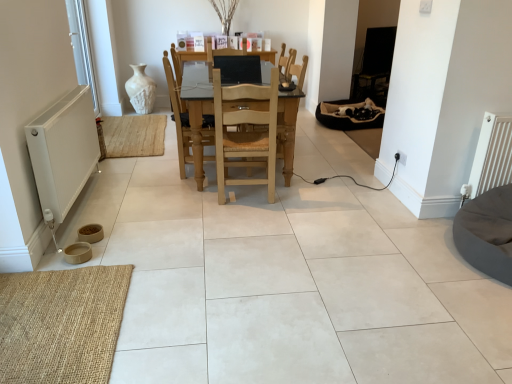
The image size is (512, 384). I want to click on white plastic window screen at left, so click(82, 48).

The width and height of the screenshot is (512, 384). What do you see at coordinates (82, 48) in the screenshot?
I see `white plastic window screen at left` at bounding box center [82, 48].

What do you see at coordinates (199, 130) in the screenshot? I see `light wood table at center` at bounding box center [199, 130].

Where is `light wood table at center`? Image resolution: width=512 pixels, height=384 pixels. light wood table at center is located at coordinates (199, 130).

What do you see at coordinates (63, 153) in the screenshot? This screenshot has width=512, height=384. I see `white matte radiator at lower left` at bounding box center [63, 153].

Describe the element at coordinates (178, 118) in the screenshot. I see `light wood chair at center, the first chair when ordered from left to right` at that location.

At what (x,y) coordinates should I click in order to perform the action: click on soft black fabric bean bag at center right, the 1th bean bag chair from the back. Please return your answer as a coordinate pair (x, y). This screenshot has height=384, width=512. Looking at the image, I should click on (347, 116).

Could you measure the distance between soft black fabric bean bag at center right, which appears as the 2th bean bag chair when ordered from the bottom, and white plastic window screen at left?

They are 2.73 meters apart.

From the picture: Considering the relative sizes of soft black fabric bean bag at center right, the 2th bean bag chair in the front-to-back sequence, and white plastic window screen at left in the image provided, is soft black fabric bean bag at center right, the 2th bean bag chair in the front-to-back sequence, taller than white plastic window screen at left?

No.

Consider the image. From a real-world perspective, between soft black fabric bean bag at center right, which appears as the 2th bean bag chair when ordered from the bottom, and white plastic window screen at left, who is vertically lower?

soft black fabric bean bag at center right, which appears as the 2th bean bag chair when ordered from the bottom.

From the image's perspective, who appears lower, soft black fabric bean bag at center right, the first bean bag chair viewed from the top, or white plastic window screen at left?

soft black fabric bean bag at center right, the first bean bag chair viewed from the top, appears lower in the image.

Is light wood table at center facing away from white plastic window screen at left?

No, light wood table at center is not facing away from white plastic window screen at left.

Considering the sizes of light wood table at center and white plastic window screen at left in the image, is light wood table at center taller or shorter than white plastic window screen at left?

light wood table at center is shorter than white plastic window screen at left.

Which is behind, light wood table at center or white plastic window screen at left?

white plastic window screen at left is further away from the camera.

From the image's perspective, would you say light wood table at center is positioned over white plastic window screen at left?

Incorrect, from the image's perspective, light wood table at center is lower than white plastic window screen at left.

How much distance is there between matte black monitor at center and light wood table at center?

A distance of 17.16 inches exists between matte black monitor at center and light wood table at center.

From the picture: Would you consider matte black monitor at center to be distant from light wood table at center?

They are positioned close to each other.

Does matte black monitor at center have a lesser width compared to light wood table at center?

Yes, matte black monitor at center is thinner than light wood table at center.

Identify the location of computer located behind the light wood table at center. The height and width of the screenshot is (384, 512). (239, 69).

Who is bigger, white matte radiator at lower left or dark gray fabric bean bag at lower right, arranged as the second bean bag chair when viewed from the back?

With larger size is dark gray fabric bean bag at lower right, arranged as the second bean bag chair when viewed from the back.

From a real-world perspective, is white matte radiator at lower left beneath dark gray fabric bean bag at lower right, which is the first bean bag chair from front to back?

No.

Does white matte radiator at lower left turn towards dark gray fabric bean bag at lower right, which is the first bean bag chair from front to back?

Yes.

Is white matte radiator at lower left positioned behind dark gray fabric bean bag at lower right, the 1th bean bag chair in the bottom-to-top sequence?

That is True.

Is white plastic window screen at left looking in the opposite direction of light wood table at center?

No.

Who is bigger, white plastic window screen at left or light wood table at center?

Bigger between the two is light wood table at center.

Based on the photo, is white plastic window screen at left located outside light wood table at center?

Yes, white plastic window screen at left is located beyond the bounds of light wood table at center.

Is white plastic window screen at left to the left of light wood table at center from the viewer's perspective?

Yes.

Which object is positioned more to the right, soft black fabric bean bag at center right, which appears as the 2th bean bag chair when ordered from the bottom, or matte black monitor at center?

From the viewer's perspective, soft black fabric bean bag at center right, which appears as the 2th bean bag chair when ordered from the bottom, appears more on the right side.

From the picture: Relative to matte black monitor at center, is soft black fabric bean bag at center right, which appears as the 2th bean bag chair when ordered from the bottom, in front or behind?

soft black fabric bean bag at center right, which appears as the 2th bean bag chair when ordered from the bottom, is positioned farther from the viewer than matte black monitor at center.

Would you say soft black fabric bean bag at center right, the 2th bean bag chair in the front-to-back sequence, is inside or outside matte black monitor at center?

soft black fabric bean bag at center right, the 2th bean bag chair in the front-to-back sequence, is outside matte black monitor at center.

Which object is wider, soft black fabric bean bag at center right, the 2th bean bag chair in the front-to-back sequence, or matte black monitor at center?

soft black fabric bean bag at center right, the 2th bean bag chair in the front-to-back sequence.

Which is correct: soft black fabric bean bag at center right, the 2th bean bag chair in the front-to-back sequence, is inside white matte radiator at lower left, or outside of it?

soft black fabric bean bag at center right, the 2th bean bag chair in the front-to-back sequence, is outside white matte radiator at lower left.

From the picture: From a real-world perspective, is soft black fabric bean bag at center right, which appears as the 2th bean bag chair when ordered from the bottom, on white matte radiator at lower left?

No, from a real-world perspective, soft black fabric bean bag at center right, which appears as the 2th bean bag chair when ordered from the bottom, is not on top of white matte radiator at lower left.

In the image, is soft black fabric bean bag at center right, the 1th bean bag chair from the back, positioned in front of or behind white matte radiator at lower left?

soft black fabric bean bag at center right, the 1th bean bag chair from the back, is behind white matte radiator at lower left.

Which point is more distant from viewer, (325,124) or (49,168)?

The point (325,124) is farther.

Where is `bean bag chair behind the white plastic window screen at left`? This screenshot has height=384, width=512. bean bag chair behind the white plastic window screen at left is located at coordinates (347, 116).

I want to click on table located below the white plastic window screen at left (from the image's perspective), so click(199, 130).

Looking at the image, which one is located closer to burlap mat at lower left, white matte radiator at lower left or natural wood/rattan chair at center, the 2th chair when ordered from left to right?

Based on the image, white matte radiator at lower left appears to be nearer to burlap mat at lower left.

Looking at the image, which one is located closer to light wood table at center, burlap mat at lower left or dark gray fabric bean bag at lower right, the 1th bean bag chair in the bottom-to-top sequence?

Based on the image, burlap mat at lower left appears to be nearer to light wood table at center.

Looking at the image, which one is located further to matte black monitor at center, soft black fabric bean bag at center right, the 2th bean bag chair in the front-to-back sequence, or burlap mat at lower left?

Among the two, soft black fabric bean bag at center right, the 2th bean bag chair in the front-to-back sequence, is located further to matte black monitor at center.

From the picture: Which object lies nearer to the anchor point light wood table at center, light wood chair at center, the second chair viewed from the right, or soft black fabric bean bag at center right, the 1th bean bag chair from the back?

The object closer to light wood table at center is light wood chair at center, the second chair viewed from the right.

Looking at the image, which one is located further to natural wood/rattan chair at center, the 2th chair when ordered from left to right, burlap mat at lower left or dark gray fabric bean bag at lower right, arranged as the second bean bag chair when viewed from the back?

Among the two, dark gray fabric bean bag at lower right, arranged as the second bean bag chair when viewed from the back, is located further to natural wood/rattan chair at center, the 2th chair when ordered from left to right.

Based on their spatial positions, is light wood chair at center, the second chair viewed from the right, or light wood table at center closer to matte black monitor at center?

light wood table at center is closer to matte black monitor at center.

Looking at the image, which one is located closer to white matte radiator at lower left, light wood chair at center, the second chair viewed from the right, or white plastic window screen at left?

light wood chair at center, the second chair viewed from the right, is positioned closer to the anchor white matte radiator at lower left.

Based on their spatial positions, is light wood table at center or dark gray fabric bean bag at lower right, which is the first bean bag chair from front to back, further from light wood chair at center, the first chair when ordered from left to right?

Among the two, dark gray fabric bean bag at lower right, which is the first bean bag chair from front to back, is located further to light wood chair at center, the first chair when ordered from left to right.

Where is `appliance positioned between dark gray fabric bean bag at lower right, arranged as the second bean bag chair when viewed from the back, and soft black fabric bean bag at center right, the first bean bag chair viewed from the top, from near to far`? The width and height of the screenshot is (512, 384). appliance positioned between dark gray fabric bean bag at lower right, arranged as the second bean bag chair when viewed from the back, and soft black fabric bean bag at center right, the first bean bag chair viewed from the top, from near to far is located at coordinates (63, 153).

Where is `appliance between white plastic window screen at left and dark gray fabric bean bag at lower right, arranged as the second bean bag chair when viewed from the back, from left to right`? The image size is (512, 384). appliance between white plastic window screen at left and dark gray fabric bean bag at lower right, arranged as the second bean bag chair when viewed from the back, from left to right is located at coordinates (63, 153).

At what (x,y) coordinates should I click in order to perform the action: click on chair between light wood table at center and dark gray fabric bean bag at lower right, the 1th bean bag chair in the bottom-to-top sequence, from left to right. Please return your answer as a coordinate pair (x, y). Looking at the image, I should click on (245, 132).

This screenshot has width=512, height=384. Find the location of `table located between white matte radiator at lower left and natural wood/rattan chair at center, the 2th chair when ordered from left to right, in the left-right direction`. table located between white matte radiator at lower left and natural wood/rattan chair at center, the 2th chair when ordered from left to right, in the left-right direction is located at coordinates (199, 130).